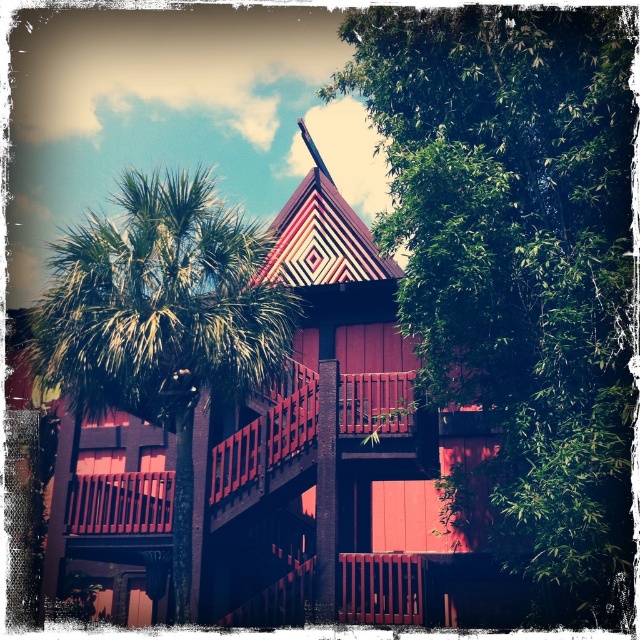
You are an architect designing a new garden layout around the building. You need to place a bench between the green leafy tree at upper right and the green leafy palm tree at left. Based on their widths, which tree should the bench be closer to?

The bench should be placed closer to the green leafy tree at upper right because it has a smaller width compared to the green leafy palm tree at left, allowing for better spacing around the wider palm tree.

You are standing in front of the building and notice two green leafy trees. Which one, the green leafy tree at upper right or the green leafy palm tree at left, is positioned lower in the image?

The green leafy tree at upper right is positioned lower than the green leafy palm tree at left in the image.